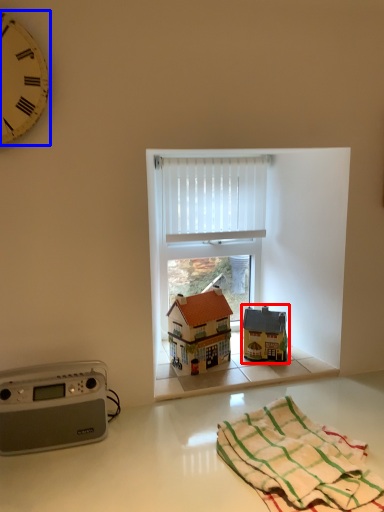
Question: Which object appears closest to the camera in this image, toy (highlighted by a red box) or clock (highlighted by a blue box)?

Choices:
 (A) toy
 (B) clock

Answer: (B)